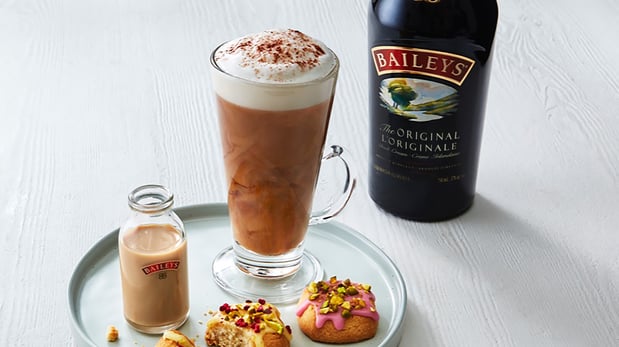
Locate an element on the screen. This screenshot has height=347, width=619. bottle is located at coordinates (423, 190).